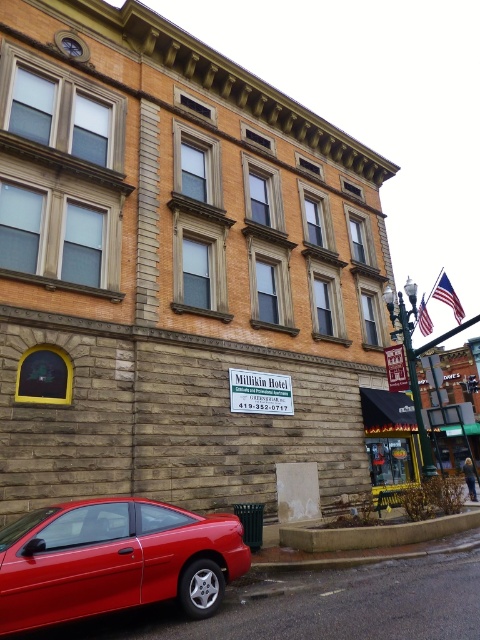
In the scene shown: You are standing in front of the Millikin Hotel building. There are two points marked on the building facade. The first point is at coordinates point [110,532] and the second point is at point [421,451]. Which of these two points is closer to you?

Point [110,532] is closer to the viewer than point [421,451].

You are a delivery person who needs to park your 1.8 meter tall truck next to the matte red car at lower left. Can the truck fit under the metallic gold street sign at center without hitting it?

The matte red car at lower left is shorter than the metallic gold street sign at center. Since the truck is 1.8 meters tall, and the sign is taller than the car, the truck should be able to fit under the metallic gold street sign at center as long as the car itself doesn not block the path.